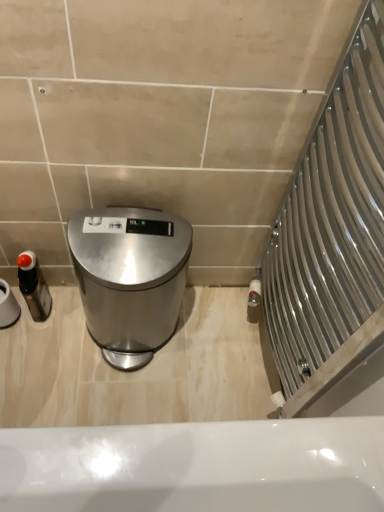
Question: Are satin silver trash can at center and white matte toilet paper at left far apart?

Choices:
 (A) yes
 (B) no

Answer: (B)

Question: Can you confirm if satin silver trash can at center is positioned to the left of white matte toilet paper at left?

Choices:
 (A) no
 (B) yes

Answer: (A)

Question: From the image's perspective, does satin silver trash can at center appear higher than white matte toilet paper at left?

Choices:
 (A) no
 (B) yes

Answer: (A)

Question: Is white matte toilet paper at left surrounded by satin silver trash can at center?

Choices:
 (A) no
 (B) yes

Answer: (A)

Question: Is satin silver trash can at center to the right of white matte toilet paper at left from the viewer's perspective?

Choices:
 (A) yes
 (B) no

Answer: (A)

Question: Does point (41, 286) appear closer or farther from the camera than point (14, 318)?

Choices:
 (A) closer
 (B) farther

Answer: (B)

Question: Choose the correct answer: Is matte black bottle at left inside white matte toilet paper at left or outside it?

Choices:
 (A) outside
 (B) inside

Answer: (A)

Question: From the image's perspective, relative to white matte toilet paper at left, is matte black bottle at left above or below?

Choices:
 (A) above
 (B) below

Answer: (B)

Question: Is matte black bottle at left to the left or to the right of white matte toilet paper at left in the image?

Choices:
 (A) left
 (B) right

Answer: (B)

Question: In terms of height, does matte black bottle at left look taller or shorter compared to satin silver trash can at center?

Choices:
 (A) tall
 (B) short

Answer: (B)

Question: From a real-world perspective, is matte black bottle at left positioned above or below satin silver trash can at center?

Choices:
 (A) above
 (B) below

Answer: (B)

Question: In the image, is matte black bottle at left positioned in front of or behind satin silver trash can at center?

Choices:
 (A) behind
 (B) front

Answer: (A)

Question: In terms of size, does matte black bottle at left appear bigger or smaller than satin silver trash can at center?

Choices:
 (A) small
 (B) big

Answer: (A)

Question: Looking at their shapes, would you say white matte toilet paper at left is wider or thinner than satin silver trash can at center?

Choices:
 (A) wide
 (B) thin

Answer: (B)

Question: Relative to satin silver trash can at center, is white matte toilet paper at left in front or behind?

Choices:
 (A) front
 (B) behind

Answer: (B)